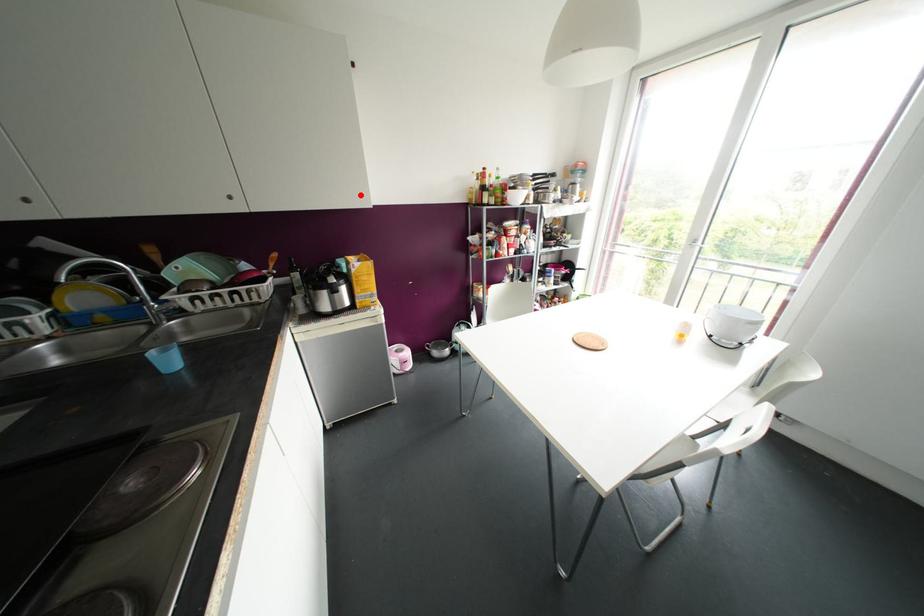
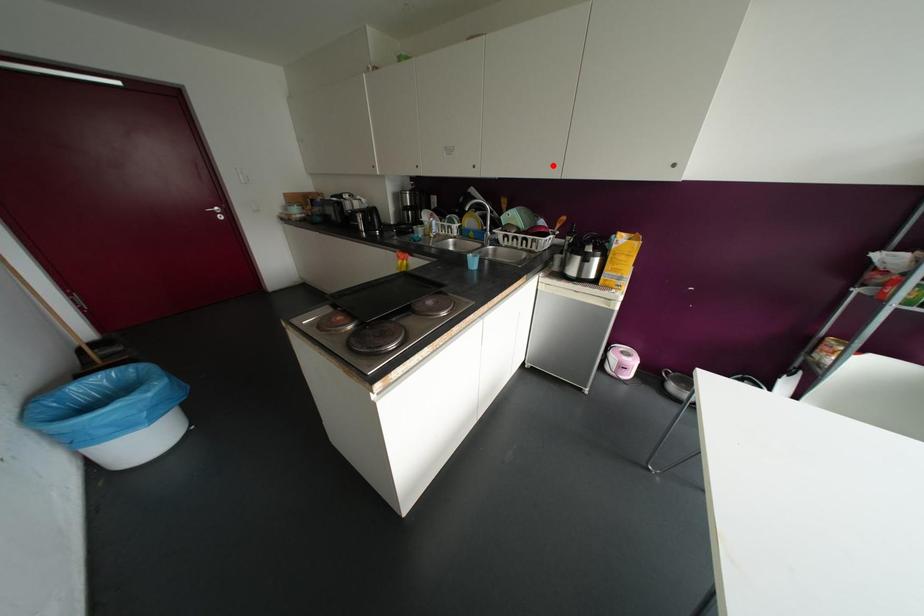
I am providing you with two images of the same scene from different viewpoints. A red point is marked on the first image and another point is marked on the second image. Do the highlighted points in image1 and image2 indicate the same real-world spot?

No